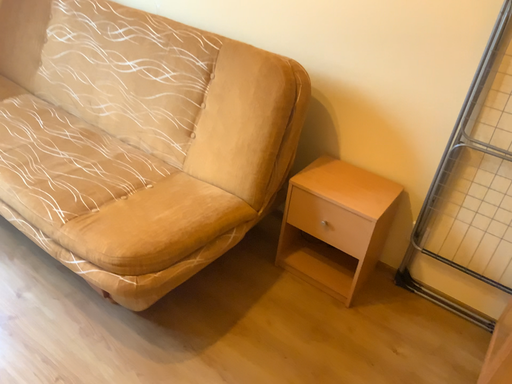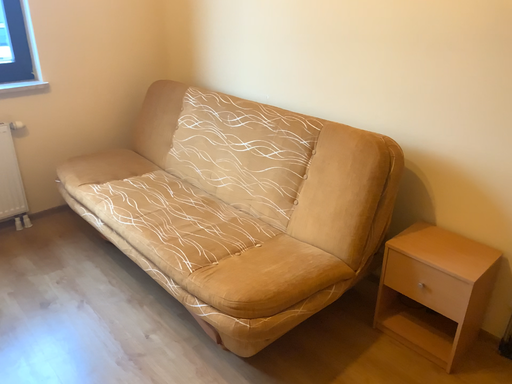
Question: How did the camera likely rotate when shooting the video?

Choices:
 (A) rotated upward
 (B) rotated downward

Answer: (A)